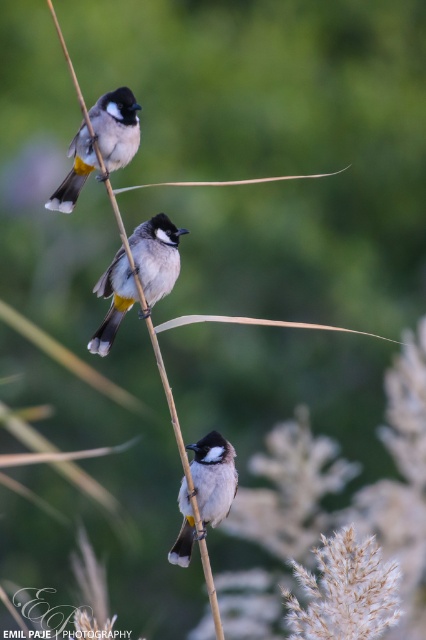
Question: Which object is closer to the camera taking this photo?

Choices:
 (A) gray matte bird at center
 (B) white-feathered bird at upper center

Answer: (A)

Question: Is gray matte bird at center positioned at the back of white-feathered bird at upper center?

Choices:
 (A) no
 (B) yes

Answer: (A)

Question: Considering the real-world distances, which object is farthest from the white-feathered bird at upper center?

Choices:
 (A) white matte bird at center
 (B) gray matte bird at center

Answer: (A)

Question: Which of the following is the farthest from the observer?

Choices:
 (A) gray matte bird at center
 (B) white-feathered bird at upper center

Answer: (B)

Question: Is the position of white-feathered bird at upper center less distant than that of white matte bird at center?

Choices:
 (A) yes
 (B) no

Answer: (B)

Question: Does gray matte bird at center come in front of white matte bird at center?

Choices:
 (A) no
 (B) yes

Answer: (A)